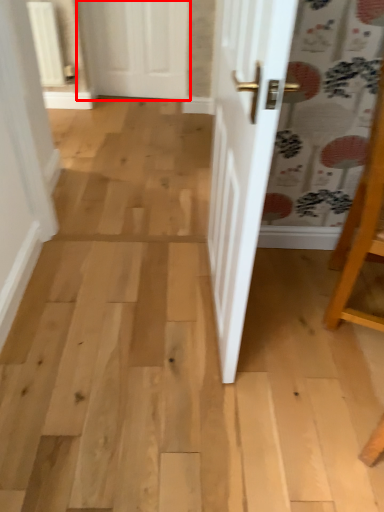
Question: From the image's perspective, what is the correct spatial positioning of door (annotated by the red box) in reference to furniture?

Choices:
 (A) below
 (B) above

Answer: (B)